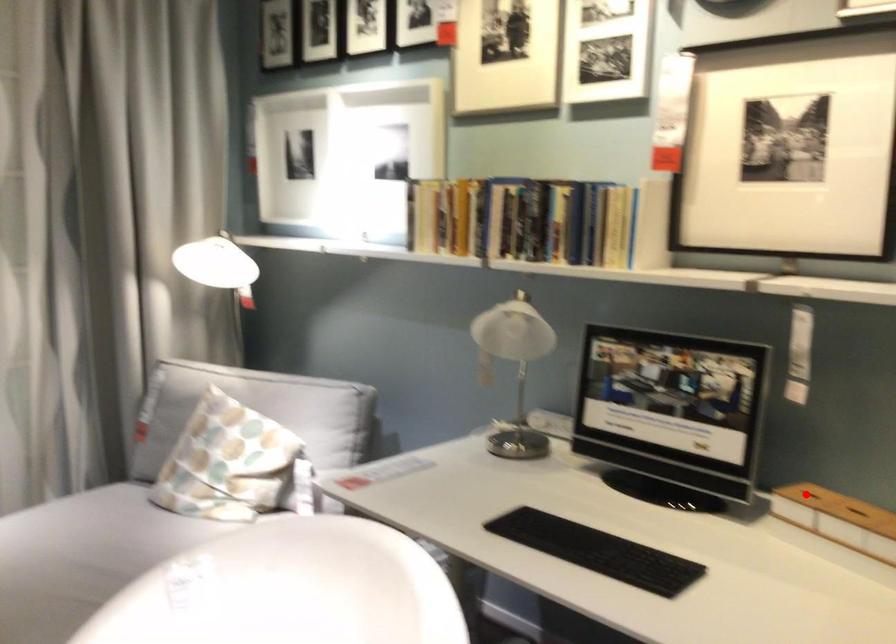
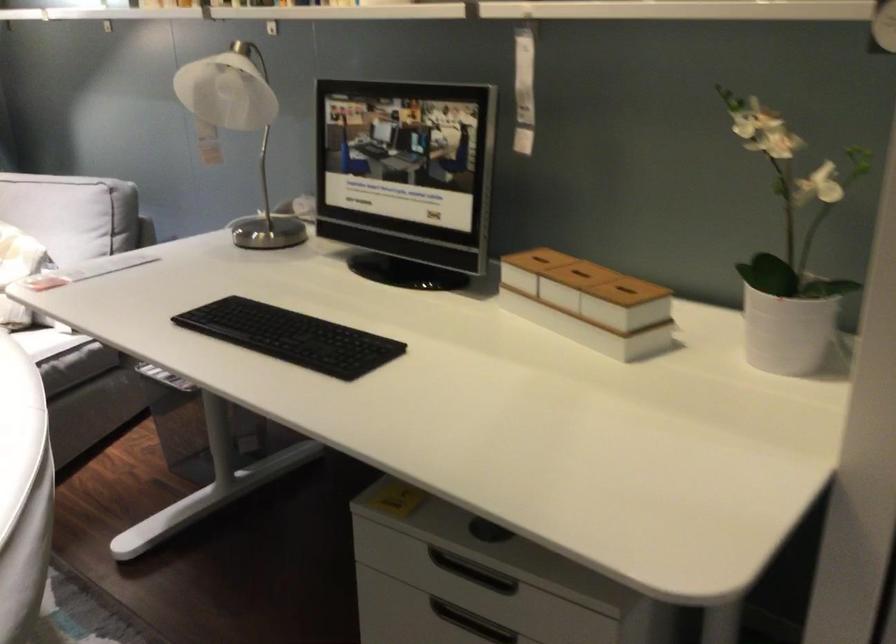
Find the pixel in the second image that matches the highlighted location in the first image.

(537, 259)